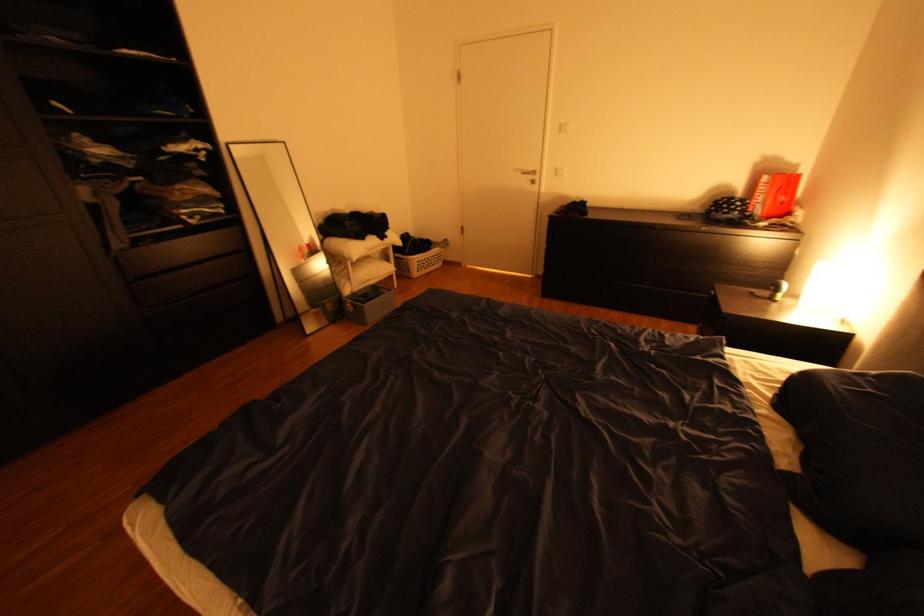
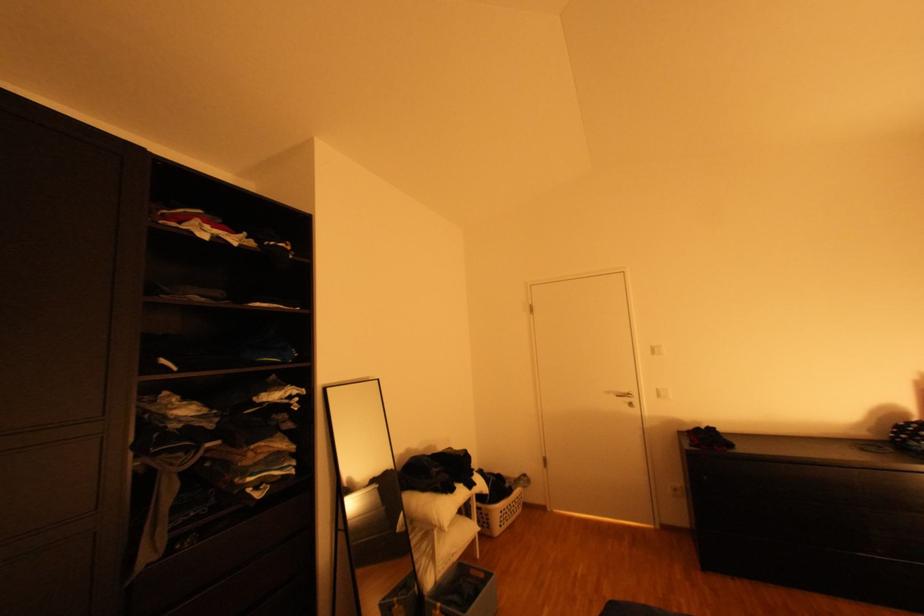
In the second image, find the point that corresponds to (x=355, y=256) in the first image.

(444, 523)